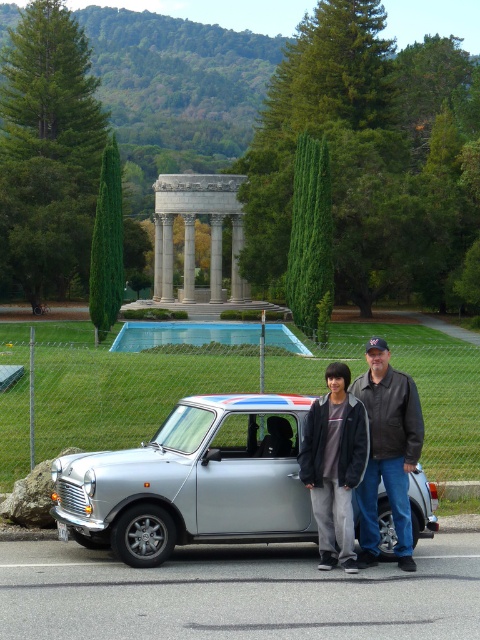
You are a photographer positioned at the front of the scene. You want to take a photo of both the silver metallic car at center and the dark gray jacket at center. Can you position yourself so that both are fully visible in the frame without any obstruction?

The silver metallic car at center is in front of the dark gray jacket at center, so if you position yourself behind the dark gray jacket at center, both the silver metallic car at center and the dark gray jacket at center will be visible in the frame without obstruction.

Looking at this image, you are a delivery person who needs to place a package between the silver metallic car at center and the dark gray jacket at center. The package requires 4 feet of space to be placed safely. Can you fit it there?

The distance between the silver metallic car at center and the dark gray jacket at center is 5.38 feet, which is more than enough to safely place the package requiring 4 feet of space.

You are a photographer planning to take a photo of the silver metallic car at center and the dark gray jacket at center. Since you want both subjects to be clearly visible in the frame, which one should you focus on first to ensure proper depth of field?

The silver metallic car at center is much taller than the dark gray jacket at center, so you should focus on the silver metallic car at center first to ensure both are in focus.